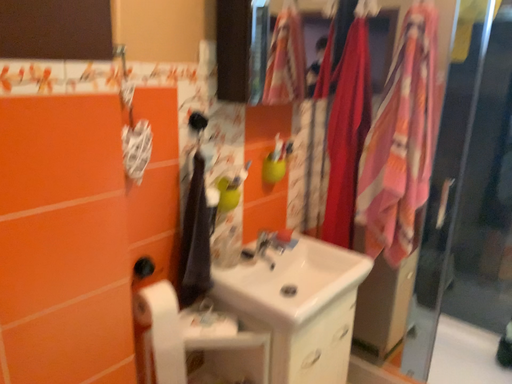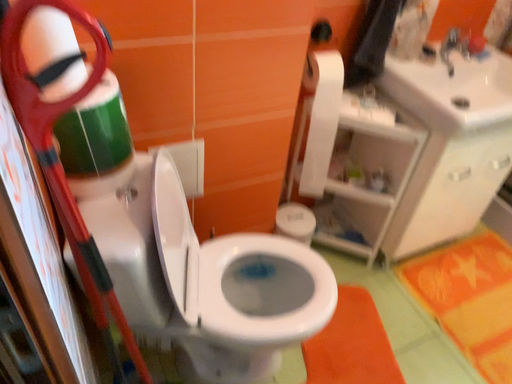
Question: Which way did the camera rotate in the video?

Choices:
 (A) rotated left
 (B) rotated right

Answer: (A)